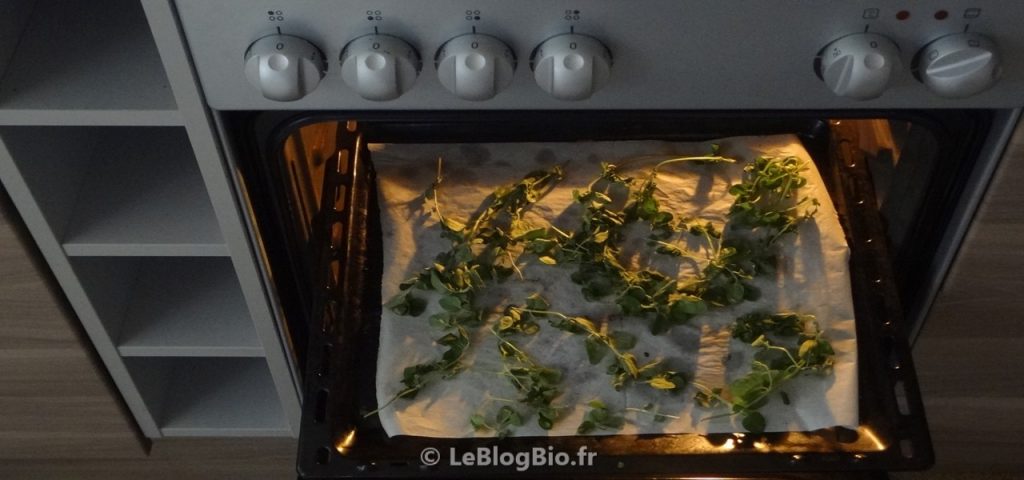
Identify the location of knob on right. The image size is (1024, 480). (948, 70).